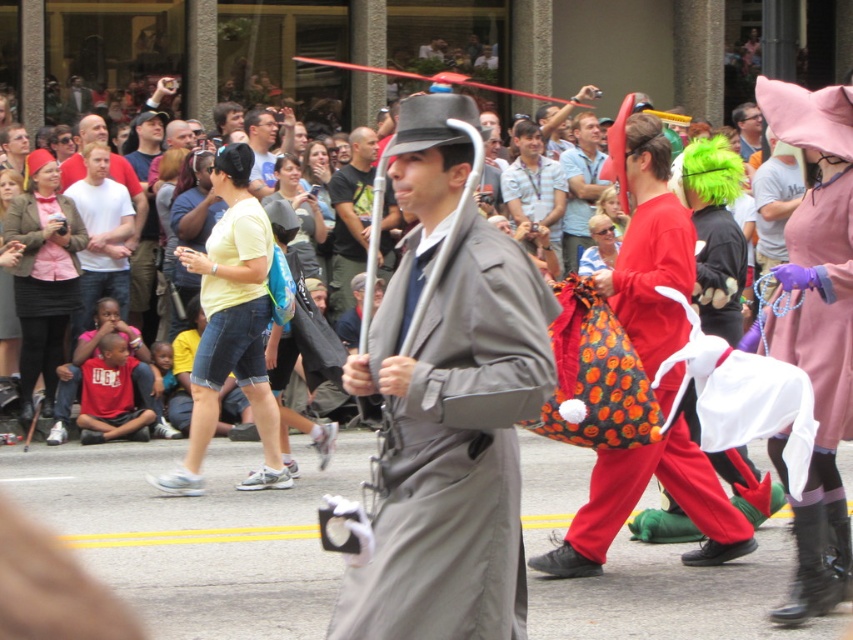
Question: Which of the following is the farthest from the observer?

Choices:
 (A) (119, 196)
 (B) (366, 179)
 (C) (581, 122)

Answer: (C)

Question: Can you confirm if matte black hat at center is positioned below matte black shirt at center?

Choices:
 (A) no
 (B) yes

Answer: (B)

Question: Can you confirm if matte black hat at center is thinner than matte black shirt at center?

Choices:
 (A) no
 (B) yes

Answer: (A)

Question: Among these points, which one is farthest from the camera?

Choices:
 (A) (556, 221)
 (B) (650, 317)

Answer: (A)

Question: Which object is positioned closest to the matte black shirt at center?

Choices:
 (A) orange fabric bag at center
 (B) matte black hat at center
 (C) matte gray coat at center
 (D) light blue shirt at center

Answer: (B)

Question: Does light blue shirt at center appear on the left side of matte orange bag at center?

Choices:
 (A) yes
 (B) no

Answer: (A)